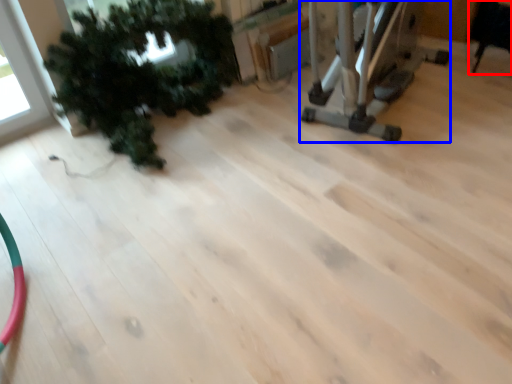
Question: Which point is further to the camera, chair (highlighted by a red box) or equipment (highlighted by a blue box)?

Choices:
 (A) chair
 (B) equipment

Answer: (A)